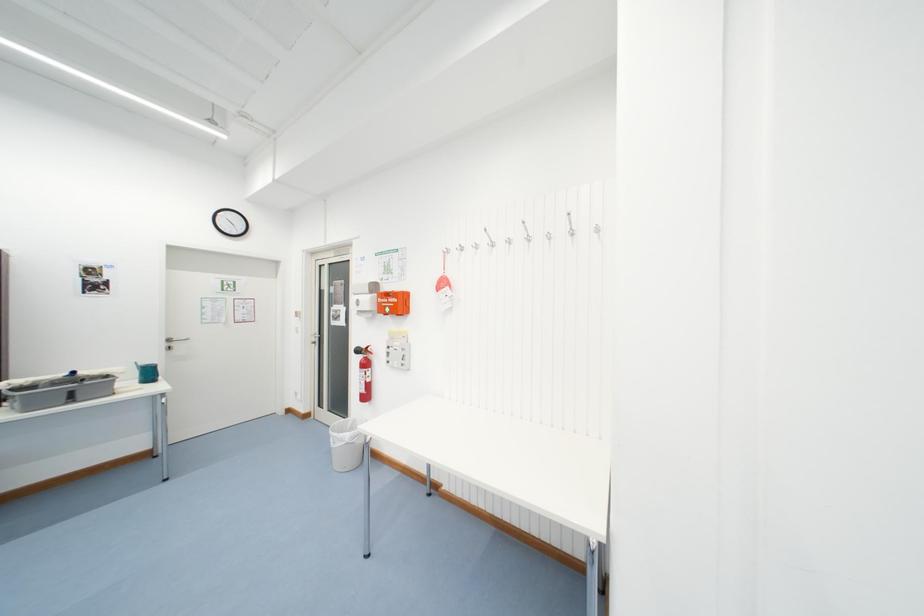
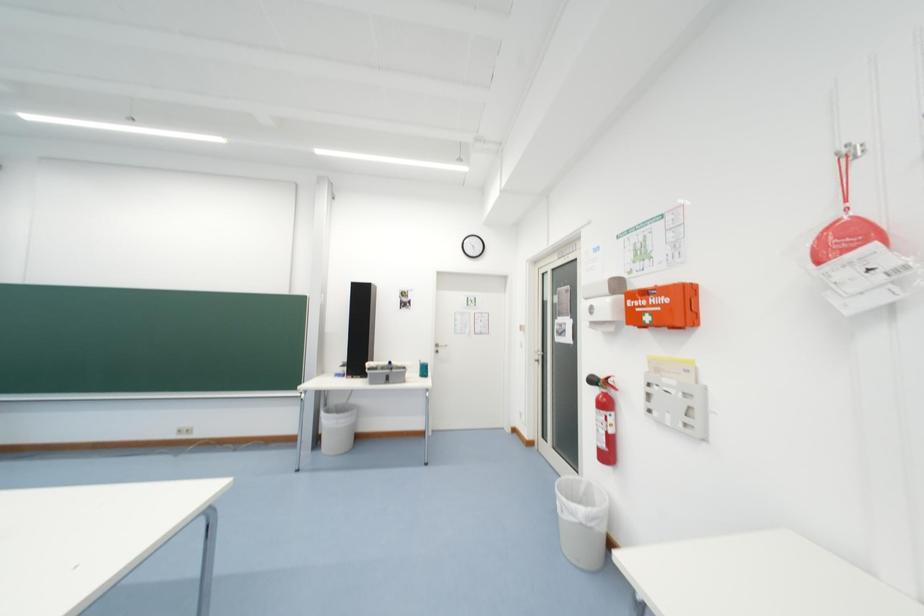
Question: Based on the continuous images, in which direction is the camera rotating? Reply with the corresponding letter.

Choices:
 (A) Left
 (B) Right
 (C) Up
 (D) Down

Answer: (A)